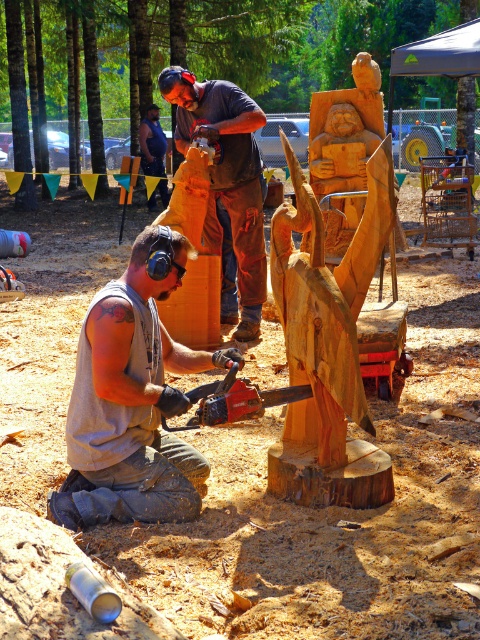
Question: Which point is farther to the camera?

Choices:
 (A) dark blue shirt at upper center
 (B) wooden chainsaw at center
 (C) natural wood carving at center

Answer: (A)

Question: Which object is farther from the camera taking this photo?

Choices:
 (A) gray fabric sleeveless shirt at lower left
 (B) wooden statue at center
 (C) wooden chainsaw at center
 (D) dark blue shirt at upper center

Answer: (D)

Question: Which is farther from the wooden chainsaw at center?

Choices:
 (A) gray fabric sleeveless shirt at lower left
 (B) dark blue shirt at upper center

Answer: (B)

Question: Does wooden statue at center appear under dark blue shirt at upper center?

Choices:
 (A) no
 (B) yes

Answer: (B)

Question: Is wooden chainsaw at center positioned at the back of dark blue shirt at upper center?

Choices:
 (A) yes
 (B) no

Answer: (B)

Question: Observing the image, what is the correct spatial positioning of wooden statue at center in reference to dark blue shirt at upper center?

Choices:
 (A) above
 (B) below

Answer: (B)